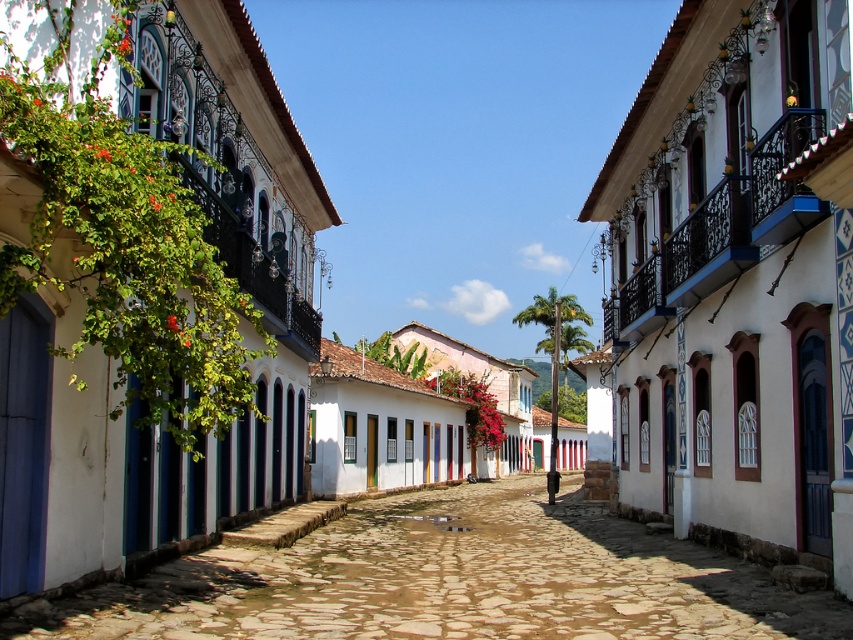
Question: Which point is closer to the camera?

Choices:
 (A) white painted wall at left
 (B) white painted wall at center

Answer: (A)

Question: Which of the following is the farthest from the observer?

Choices:
 (A) (334, 577)
 (B) (694, 80)

Answer: (B)

Question: Observing the image, what is the correct spatial positioning of white painted wall at center in reference to white painted wall at left?

Choices:
 (A) left
 (B) right

Answer: (B)

Question: Does white painted wall at center have a smaller size compared to white painted wall at left?

Choices:
 (A) yes
 (B) no

Answer: (A)

Question: Which point is farther to the camera?

Choices:
 (A) (811, 275)
 (B) (653, 618)

Answer: (A)

Question: Can you confirm if white painted wall at center is wider than white painted wall at left?

Choices:
 (A) no
 (B) yes

Answer: (A)